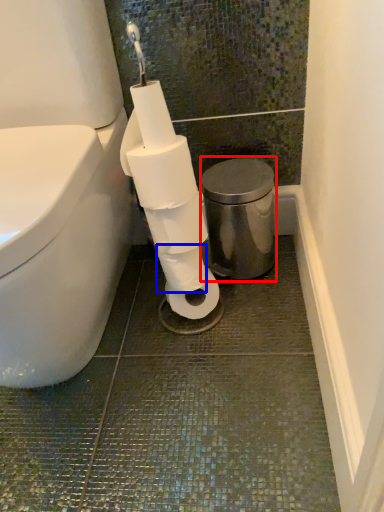
Question: Among these objects, which one is farthest to the camera, bidet (highlighted by a red box) or toilet paper (highlighted by a blue box)?

Choices:
 (A) bidet
 (B) toilet paper

Answer: (A)